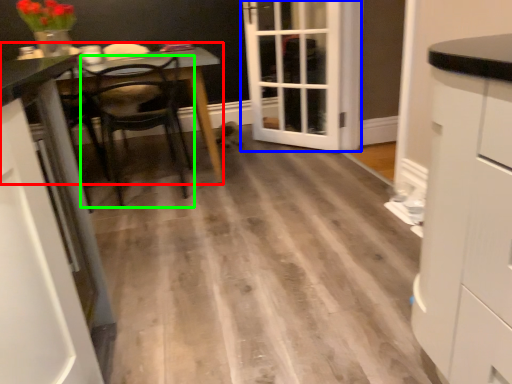
Question: Which object is the closest to the table (highlighted by a red box)? Choose among these: door (highlighted by a blue box) or chair (highlighted by a green box).

Choices:
 (A) door
 (B) chair

Answer: (B)